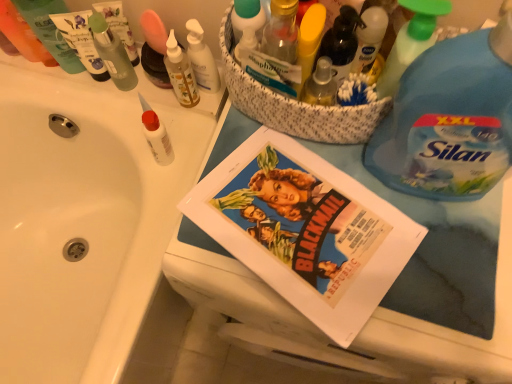
Identify the location of vacant area that is in front of translucent plastic pump bottle at upper center, the 6th toiletry in the left-to-right sequence. The height and width of the screenshot is (384, 512). (182, 151).